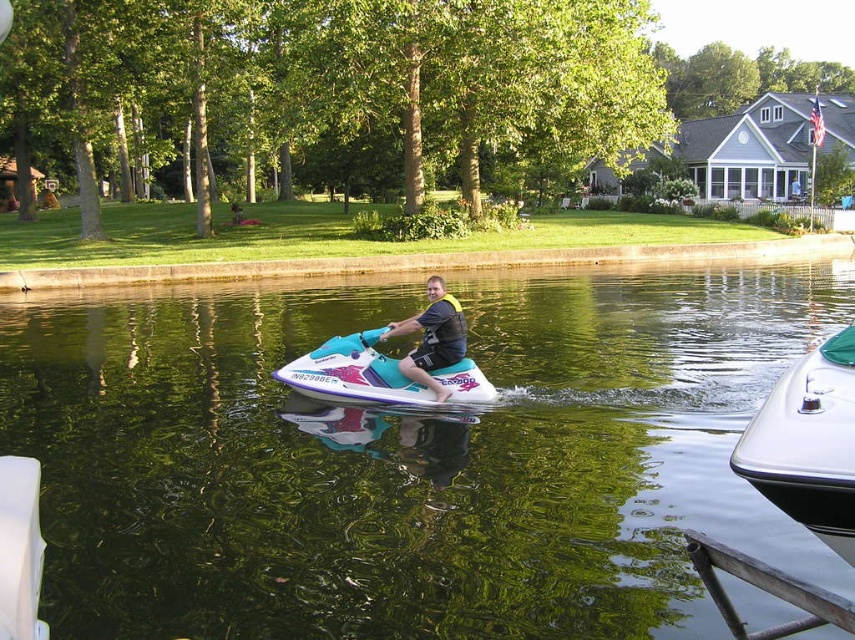
Who is taller, white glossy boat at lower right or matte black life vest at center?

Standing taller between the two is white glossy boat at lower right.

Find the location of a particular element. The height and width of the screenshot is (640, 855). white glossy boat at lower right is located at coordinates (808, 444).

Locate an element on the screen. This screenshot has width=855, height=640. white glossy boat at lower right is located at coordinates (808, 444).

Identify the location of green reflective water at center. The image size is (855, 640). (405, 456).

Is point (243, 342) farther from camera compared to point (408, 362)?

Yes.

The width and height of the screenshot is (855, 640). I want to click on green reflective water at center, so click(x=405, y=456).

Looking at this image, between teal matte jet ski at center and matte black life vest at center, which one has less height?

matte black life vest at center is shorter.

Is teal matte jet ski at center smaller than matte black life vest at center?

Actually, teal matte jet ski at center might be larger than matte black life vest at center.

Which is behind, point (467, 394) or point (443, 396)?

The point (467, 394) is behind.

Find the location of `teal matte jet ski at center`. teal matte jet ski at center is located at coordinates pos(354,372).